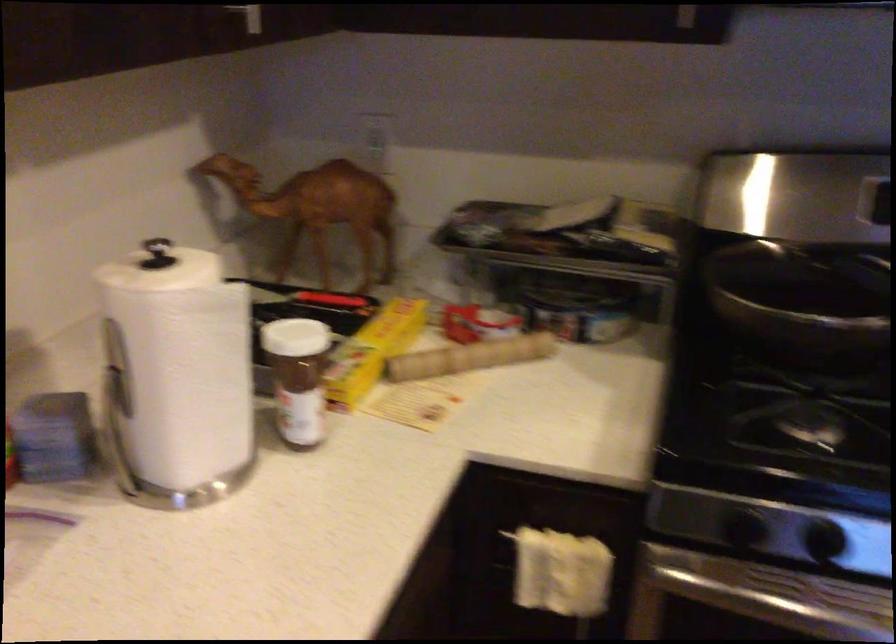
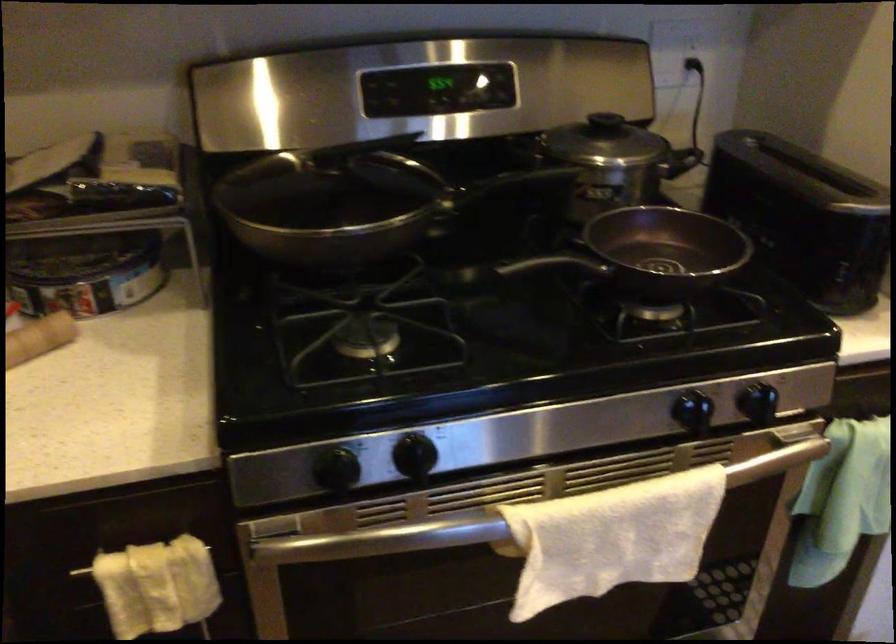
Question: The images are taken continuously from a first-person perspective. In which direction is your viewpoint rotating?

Choices:
 (A) Left
 (B) Right
 (C) Up
 (D) Down

Answer: (B)